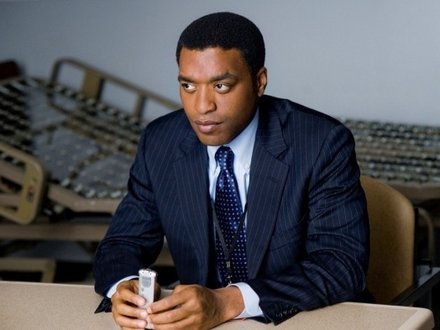
Where is `place to rest your back on chair`? This screenshot has height=330, width=440. place to rest your back on chair is located at coordinates (386, 225), (371, 208), (380, 265).